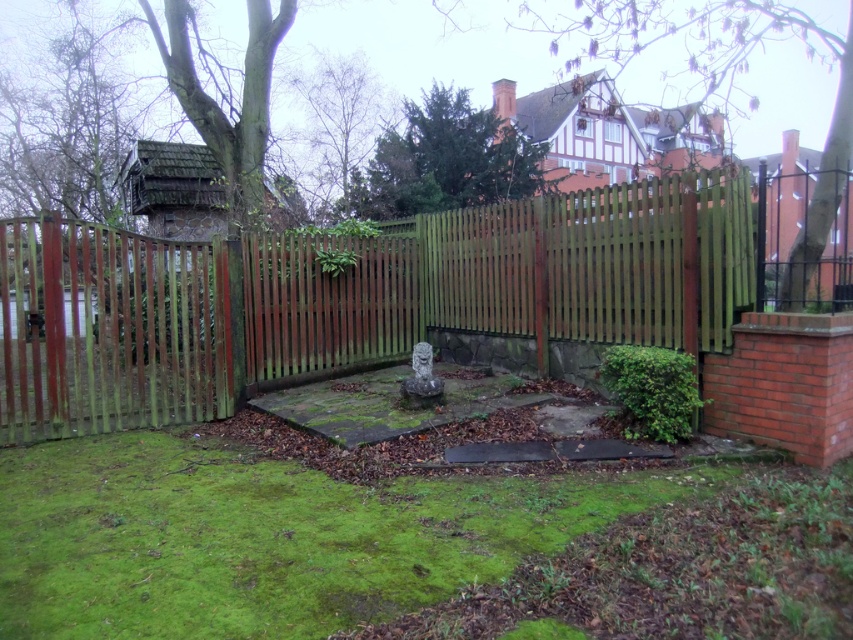
Question: Can you confirm if green wooden fence at center is thinner than green mossy grass at center?

Choices:
 (A) yes
 (B) no

Answer: (A)

Question: Does green wooden fence at center appear over green mossy grass at center?

Choices:
 (A) yes
 (B) no

Answer: (A)

Question: Among these points, which one is farthest from the camera?

Choices:
 (A) (99, 236)
 (B) (387, 596)

Answer: (A)

Question: Is green wooden fence at center smaller than green mossy grass at center?

Choices:
 (A) yes
 (B) no

Answer: (A)